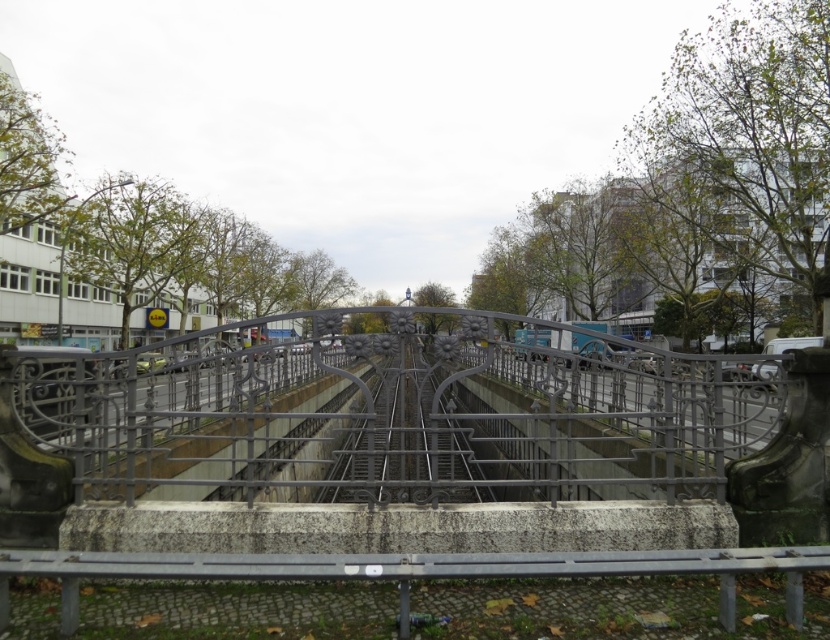
You are a photographer trying to capture the entire scene through the polished metal fence at center while also including the metallic silver train at center in your shot. Based on their sizes, which object should you focus on first to ensure both are in frame?

The polished metal fence at center is larger in size than the metallic silver train at center, so you should focus on the polished metal fence at center first to ensure both fit within the frame.

From the picture: You are standing on a platform and see the polished metal fence at center and the metallic silver train at center. Which object is closer to the ground?

The polished metal fence at center is closer to the ground because it is below the metallic silver train at center.